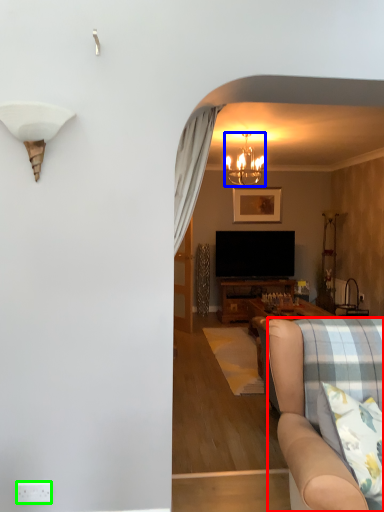
Question: Considering the real-world distances, which object is farthest from studio couch (highlighted by a red box)? lamp (highlighted by a blue box) or power outlet (highlighted by a green box)?

Choices:
 (A) lamp
 (B) power outlet

Answer: (A)